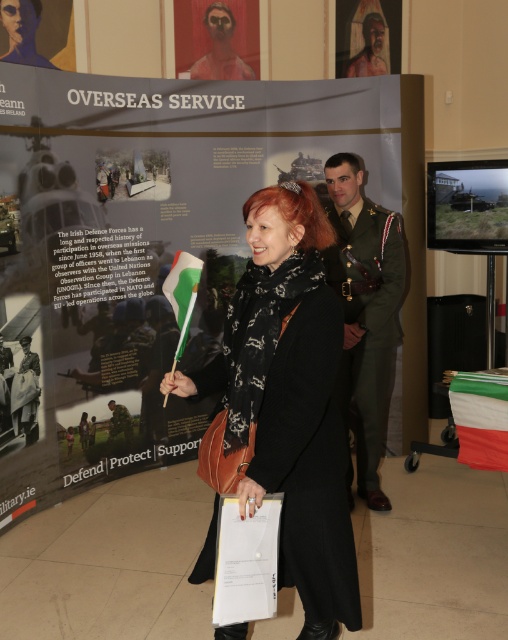
You are a security guard standing at the entrance of the museum. A woman wearing a black textured coat at center is approaching the display board titled

The distance between the black textured coat at center and the viewer is 1.81 meters, so the woman is within the required 2 meters social distancing guideline and can approach safely.

Based on the photo, you are standing at the point with coordinates point [23,58] and want to walk towards the point with coordinates point [379,65]. Based on the scene description, will you be moving towards the display board titled Overseas Service?

Yes, because point [23,58] is in front of point [379,65], so moving from the former to the latter would mean approaching the display board titled Overseas Service.

You are standing in the room and want to touch both the point at coordinates point [236,44] and the point at coordinates point [189,300]. Which point should you reach for first?

You should reach for point [236,44] first because it is closer to you than point [189,300], which is further away.